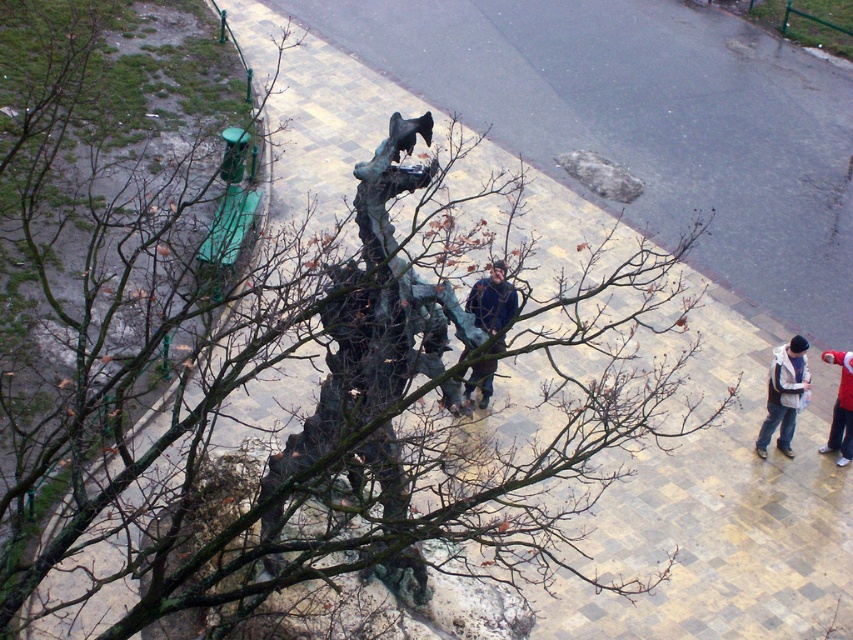
Is point (387, 461) more distant than point (782, 364)?

No, it is not.

Is bronze statue at center above gray woolen hat at lower right?

Indeed, bronze statue at center is positioned over gray woolen hat at lower right.

Locate an element on the screen. bronze statue at center is located at coordinates (376, 314).

What are the coordinates of `bronze statue at center` in the screenshot? It's located at (376, 314).

Who is shorter, dark blue jacket at center or red fabric jacket at lower right?

dark blue jacket at center is shorter.

Based on the photo, can you confirm if dark blue jacket at center is thinner than red fabric jacket at lower right?

In fact, dark blue jacket at center might be wider than red fabric jacket at lower right.

Does point (488, 289) come in front of point (849, 374)?

Yes.

Where is `dark blue jacket at center`? The height and width of the screenshot is (640, 853). dark blue jacket at center is located at coordinates (492, 300).

Is gray woolen hat at lower right positioned in front of red fabric jacket at lower right?

That is True.

Who is positioned more to the right, gray woolen hat at lower right or red fabric jacket at lower right?

Positioned to the right is red fabric jacket at lower right.

Is point (788, 387) positioned before point (846, 442)?

Yes, point (788, 387) is in front of point (846, 442).

The height and width of the screenshot is (640, 853). Identify the location of gray woolen hat at lower right. (784, 394).